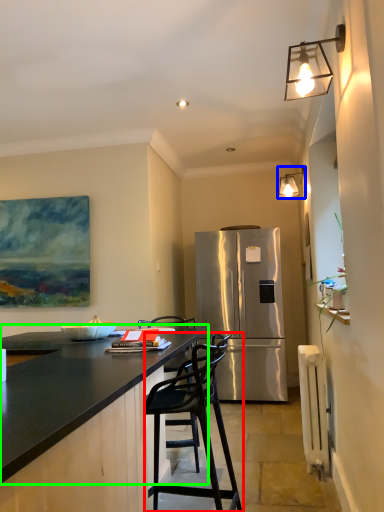
Question: Based on their relative distances, which object is farther from chair (highlighted by a red box)? Choose from lamp (highlighted by a blue box) and countertop (highlighted by a green box).

Choices:
 (A) lamp
 (B) countertop

Answer: (A)